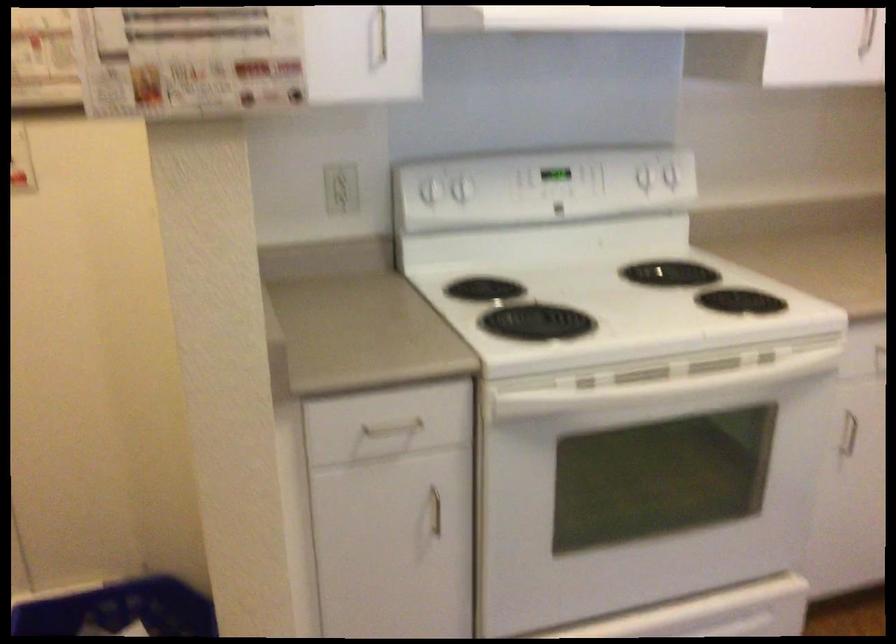
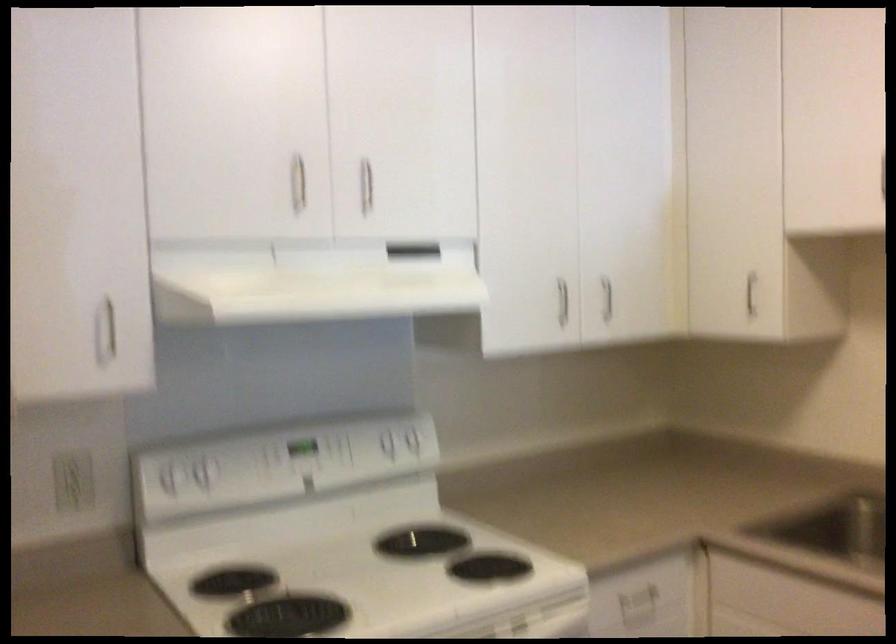
Locate, in the second image, the point that corresponds to (x=460, y=185) in the first image.

(200, 474)